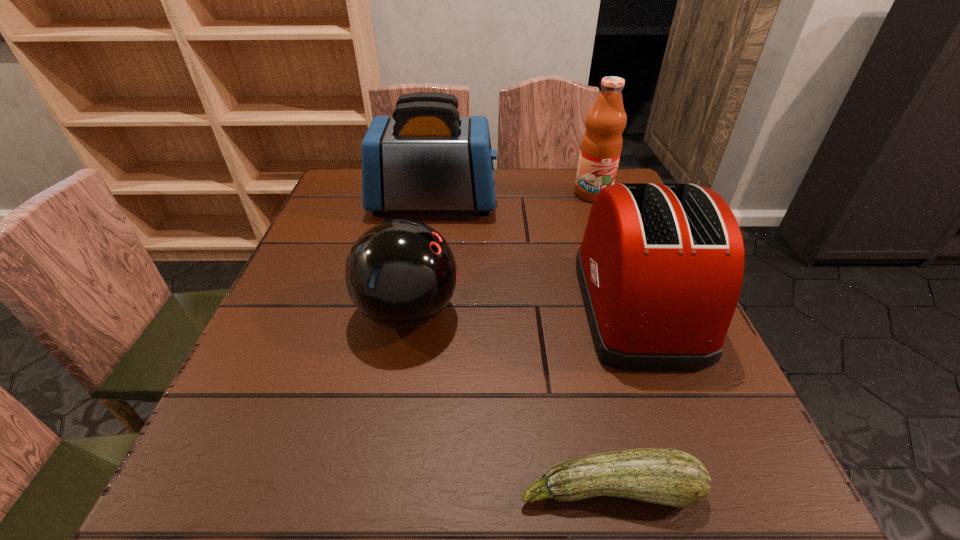
Image resolution: width=960 pixels, height=540 pixels. I want to click on fruit juice that is at the far edge, so click(601, 145).

Find the location of `toaster present at the far edge`. toaster present at the far edge is located at coordinates (426, 157).

Find the location of a particular element. Image resolution: width=960 pixels, height=540 pixels. object at the near edge is located at coordinates (665, 476).

The width and height of the screenshot is (960, 540). I want to click on object present at the left edge, so click(426, 157).

Locate an element on the screen. The image size is (960, 540). fruit juice that is positioned at the right edge is located at coordinates (601, 145).

Locate an element on the screen. toaster located in the right edge section of the desktop is located at coordinates pyautogui.click(x=660, y=267).

Locate an element on the screen. The width and height of the screenshot is (960, 540). zucchini that is at the right edge is located at coordinates (665, 476).

Find the location of `object positioned at the far left corner`. object positioned at the far left corner is located at coordinates (426, 157).

Find the location of a particular element. object at the far right corner is located at coordinates (601, 145).

Find the location of a particular element. Image resolution: width=960 pixels, height=540 pixels. object positioned at the near right corner is located at coordinates click(665, 476).